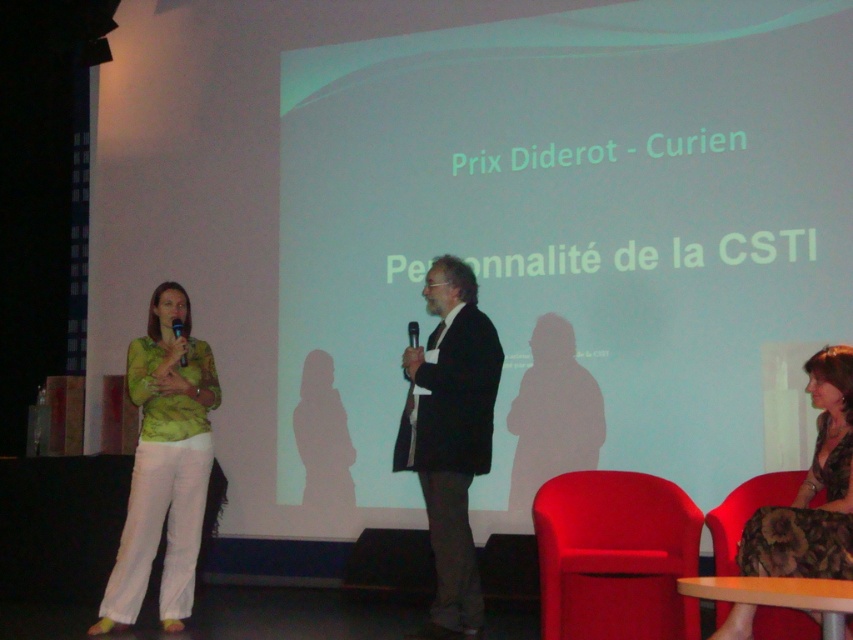
You are an event organizer and need to adjust the stage setup. The dark brown suit at center and the matte black microphone at left are currently positioned in a way that might block the view. Which object is lower and should be raised to improve visibility?

The dark brown suit at center is located below the matte black microphone at left, so raising the dark brown suit at center would improve visibility by bringing it to a higher position.

You are standing at the center of the stage and need to hand a document to the person wearing the velvet brown dress at lower right. Which direction should you move to reach them?

The velvet brown dress at lower right is located at point 0.766 on the x axis and 0.953 on the y axis, so you should move towards the lower right direction to reach them.

You are an attendee at this event and want to sit down. There is a matte red chair at lower right and a green matte shirt at left in your view. Which object is positioned to the right side of the other?

The matte red chair at lower right is positioned to the right of the green matte shirt at left.